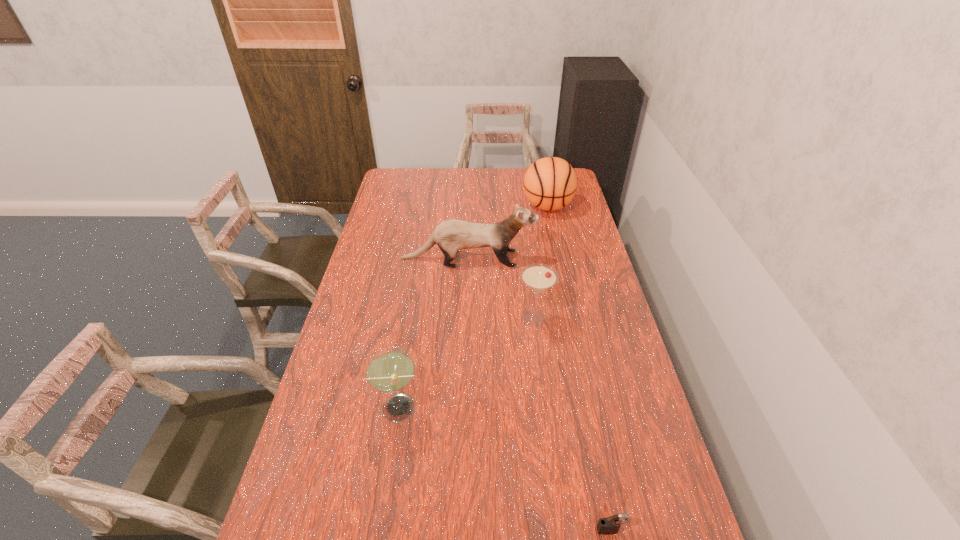
Identify the location of the farthest object. coord(550,183).

At what (x,y) coordinates should I click in order to perform the action: click on ferret. Please return your answer as a coordinate pair (x, y). This screenshot has height=540, width=960. Looking at the image, I should click on pyautogui.click(x=451, y=236).

You are a GUI agent. You are given a task and a screenshot of the screen. Output one action in this format:
    pyautogui.click(x=<x>, y=<y>)
    Task: Click on the third farthest object
    
    Given the screenshot: What is the action you would take?
    pyautogui.click(x=538, y=277)

Image resolution: width=960 pixels, height=540 pixels. Find the location of `the farther martini`. the farther martini is located at coordinates (538, 277).

You are a GUI agent. You are given a task and a screenshot of the screen. Output one action in this format:
    pyautogui.click(x=<x>, y=<y>)
    Task: Click on the second nearest object
    This screenshot has width=960, height=540.
    Given the screenshot: What is the action you would take?
    pyautogui.click(x=390, y=369)

The width and height of the screenshot is (960, 540). In order to click on the left martini in this screenshot , I will do pyautogui.click(x=390, y=369).

The image size is (960, 540). I want to click on the shortest object, so click(x=607, y=526).

At what (x,y) coordinates should I click in order to perform the action: click on the nearest object. Please return your answer as a coordinate pair (x, y). The height and width of the screenshot is (540, 960). Looking at the image, I should click on (607, 526).

Image resolution: width=960 pixels, height=540 pixels. In order to click on free location located 0.240m on the back of the farthest object in this screenshot , I will do `click(540, 170)`.

The image size is (960, 540). What are the coordinates of `vacant space located on the face of the ferret` in the screenshot? It's located at (562, 259).